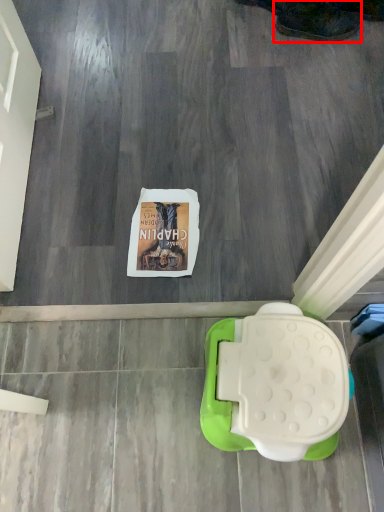
Question: From the image, what is the correct spatial relationship of footwear (annotated by the red box) in relation to toilet?

Choices:
 (A) right
 (B) left

Answer: (A)